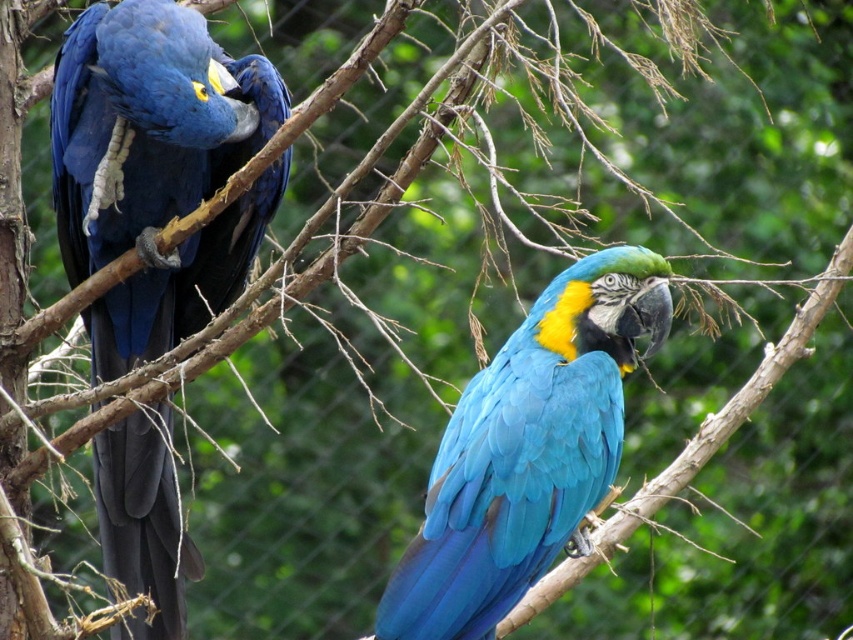
Does point (120, 228) lie in front of point (500, 355)?

No, (120, 228) is behind (500, 355).

Is the position of matte blue parrot at left more distant than that of blue glossy parrot at center?

That is True.

Which is in front, point (122, 355) or point (535, 374)?

Positioned in front is point (535, 374).

Where is `matte blue parrot at left`? The width and height of the screenshot is (853, 640). matte blue parrot at left is located at coordinates (157, 170).